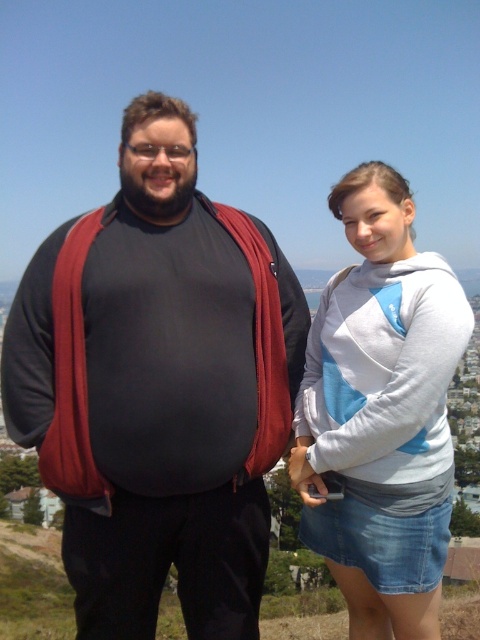
Question: Does matte black backpack at left appear under gray cotton hoodie at upper right?

Choices:
 (A) yes
 (B) no

Answer: (B)

Question: Is matte black backpack at left to the right of gray cotton hoodie at upper right from the viewer's perspective?

Choices:
 (A) yes
 (B) no

Answer: (B)

Question: Which of the following is the farthest from the observer?

Choices:
 (A) (340, 428)
 (B) (117, 205)

Answer: (B)

Question: Which of the following is the closest to the observer?

Choices:
 (A) (144, 193)
 (B) (345, 323)

Answer: (B)

Question: Can you confirm if matte black backpack at left is smaller than gray cotton hoodie at upper right?

Choices:
 (A) no
 (B) yes

Answer: (A)